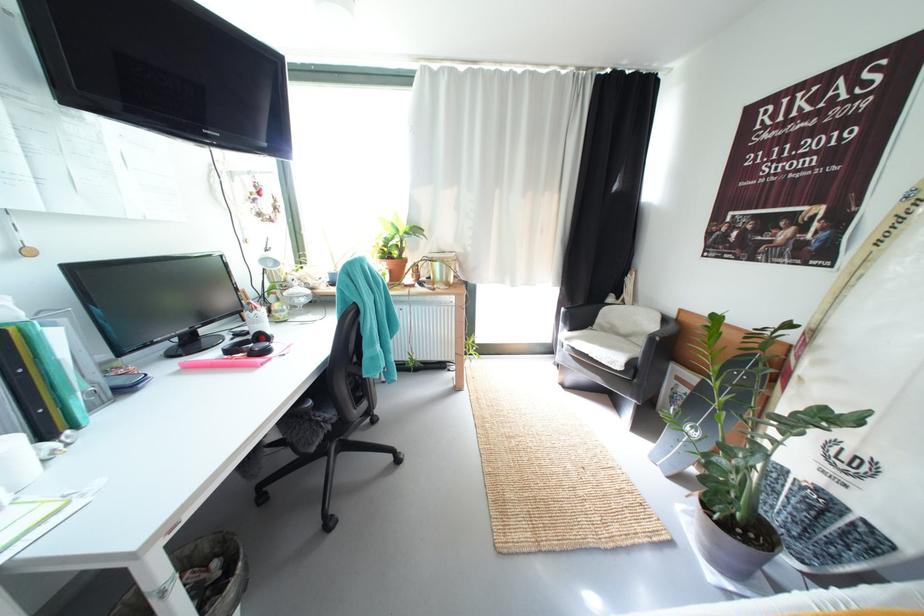
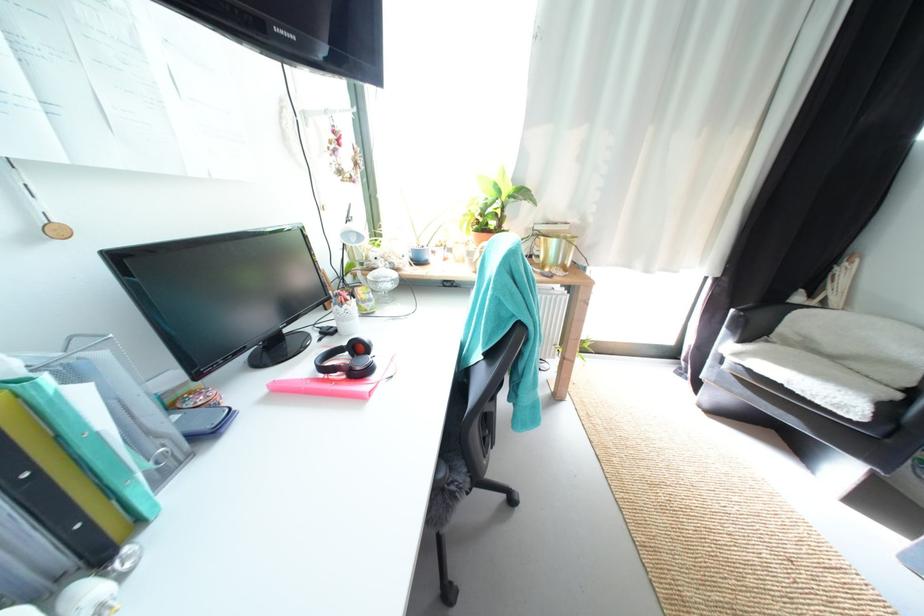
Locate, in the second image, the point that corresponds to point (272, 262) in the first image.

(354, 236)